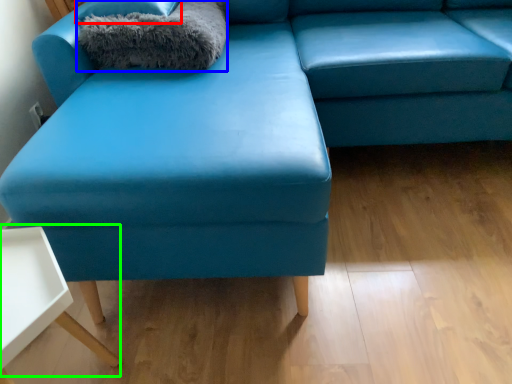
Question: Which object is positioned closest to pillow (highlighted by a red box)? Select from blanket (highlighted by a blue box) and table (highlighted by a green box).

Choices:
 (A) blanket
 (B) table

Answer: (A)